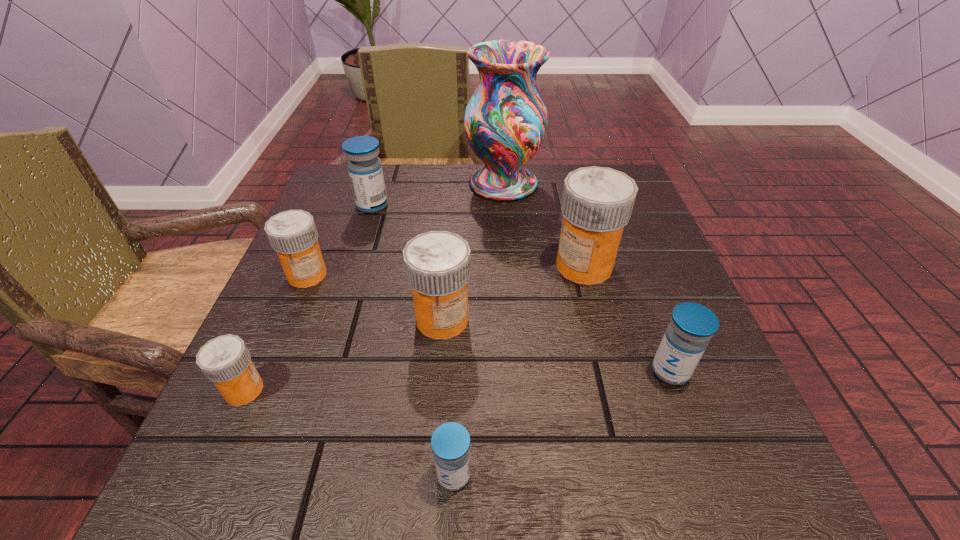
Identify the location of unoccupied position between the nearest medicine and the fifth farthest object. The height and width of the screenshot is (540, 960). tap(448, 397).

Where is `free spot between the leftmost blue medicine and the nearest orange medicine`? free spot between the leftmost blue medicine and the nearest orange medicine is located at coordinates (308, 298).

Image resolution: width=960 pixels, height=540 pixels. What are the coordinates of `vacant area between the rightmost blue medicine and the second nearest orange medicine` in the screenshot? It's located at (557, 345).

Where is `object that ranks as the closest to the nearest medicine`? object that ranks as the closest to the nearest medicine is located at coordinates (438, 266).

Choose which object is the second nearest neighbor to the tallest object. Please provide its 2D coordinates. Your answer should be formatted as a tuple, i.e. [(x, y)], where the tuple contains the x and y coordinates of a point satisfying the conditions above.

[(365, 170)]

Locate an element on the screen. the fifth closest medicine to the nearest medicine is located at coordinates (292, 234).

Find the location of a particular element. the closest medicine to the leftmost blue medicine is located at coordinates (292, 234).

Select which orange medicine appears as the third closest to the farthest medicine. Please provide its 2D coordinates. Your answer should be formatted as a tuple, i.e. [(x, y)], where the tuple contains the x and y coordinates of a point satisfying the conditions above.

[(597, 202)]

Identify the location of orange medicine that is the fourth closest to the leftmost blue medicine. (x=225, y=360).

This screenshot has width=960, height=540. I want to click on blue medicine that stands as the third closest to the second orange medicine from right to left, so point(692,325).